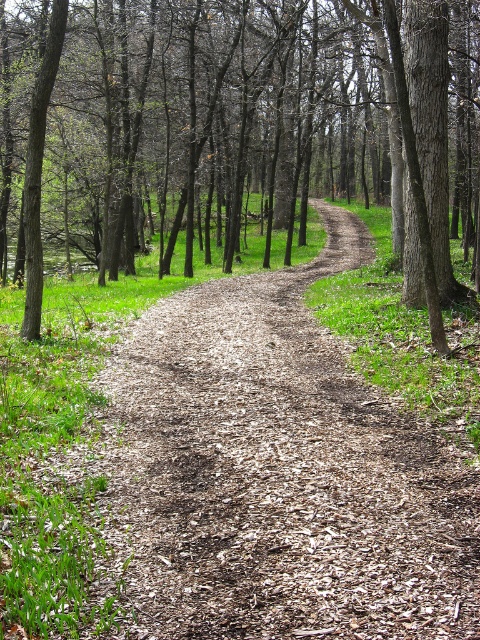
Is brown mulch dirt track at center to the left of brown bark tree at center from the viewer's perspective?

In fact, brown mulch dirt track at center is to the right of brown bark tree at center.

Between point (168, 301) and point (436, 253), which one is positioned behind?

The point (168, 301) is more distant.

Between point (302, 600) and point (139, 205), which one is positioned behind?

Point (139, 205)

Identify the location of brown mulch dirt track at center. The height and width of the screenshot is (640, 480). (277, 474).